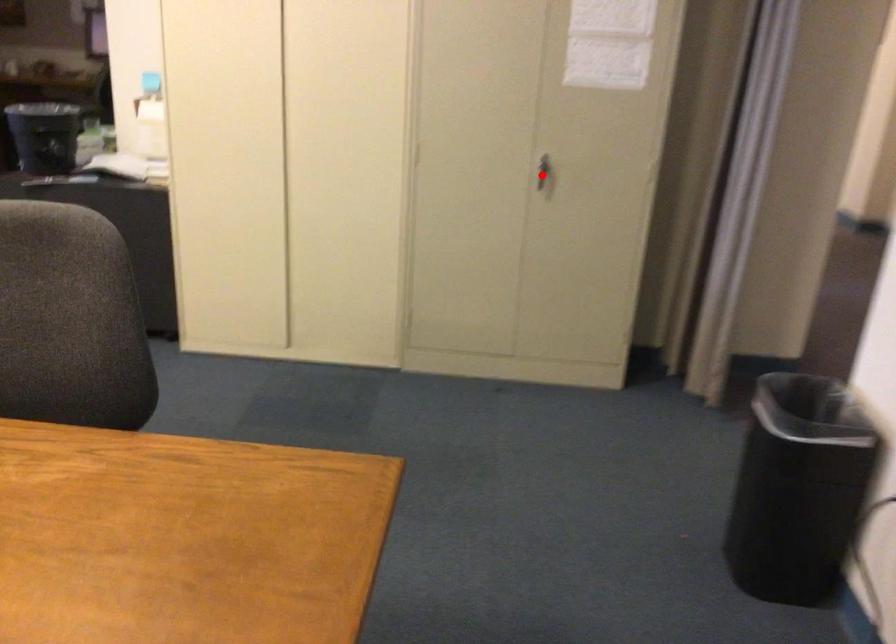
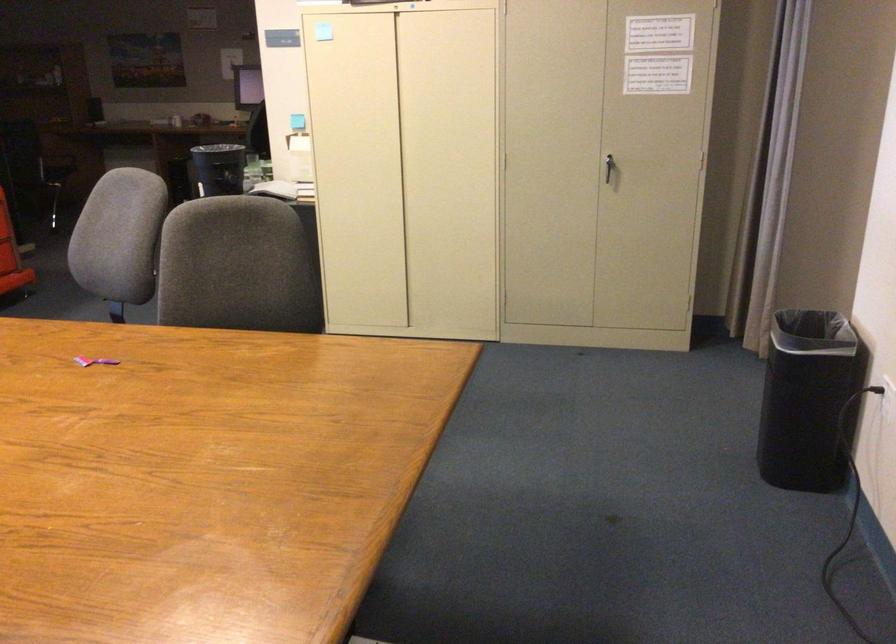
Question: I am providing you with two images of the same scene from different viewpoints. In image1, a red point is highlighted. Considering the same 3D point in image2, which of the following is correct?

Choices:
 (A) It is closer
 (B) It is farther

Answer: (B)